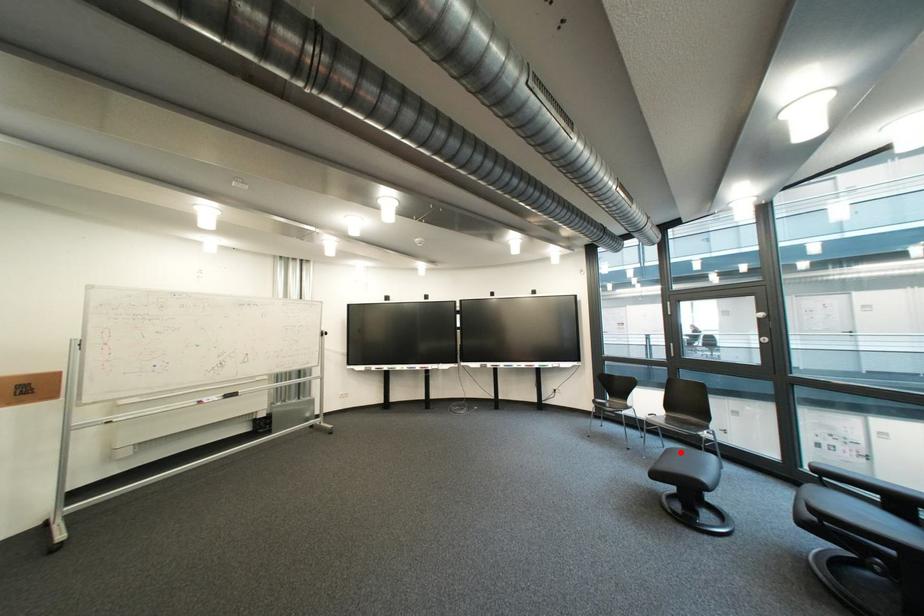
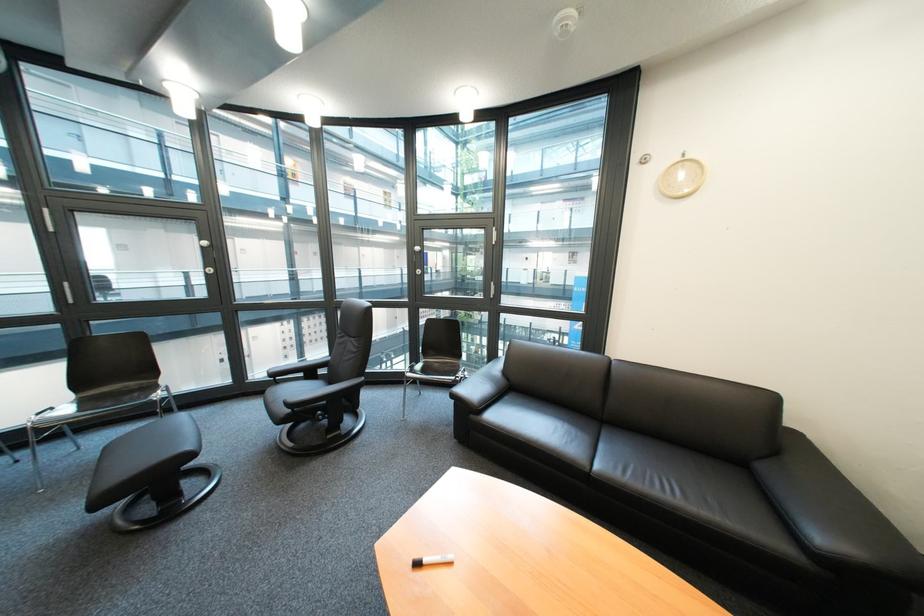
Question: A red point is marked in image1. In image2, is the corresponding 3D point closer to the camera or farther? Reply with the corresponding letter.

Choices:
 (A) The corresponding 3D point is closer.
 (B) The corresponding 3D point is farther.

Answer: (A)